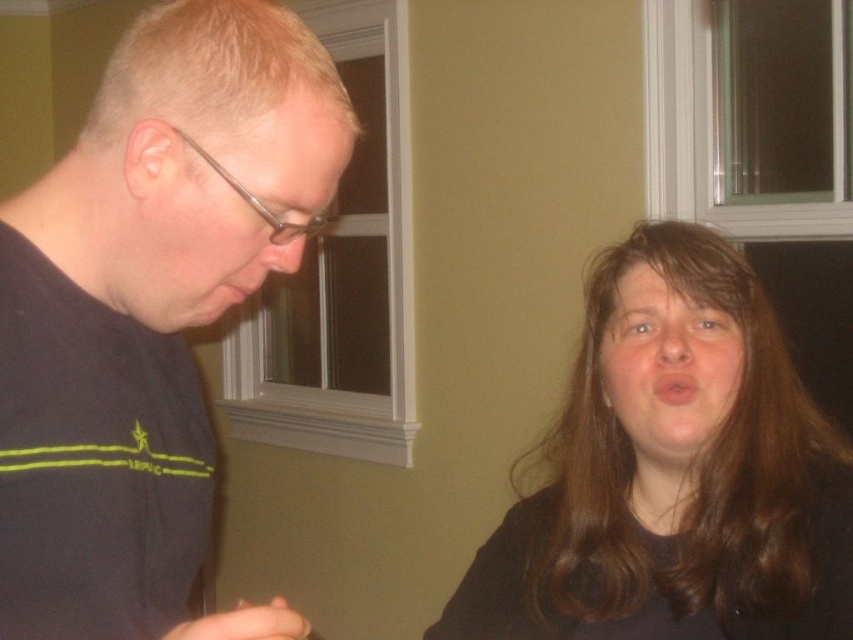
Does matte black glasses at left have a lesser height compared to matte black face at center?

Correct, matte black glasses at left is not as tall as matte black face at center.

Is matte black glasses at left to the left of matte black face at center from the viewer's perspective?

Indeed, matte black glasses at left is positioned on the left side of matte black face at center.

Is point (248, 212) less distant than point (720, 348)?

Yes, point (248, 212) is closer to viewer.

Identify the location of matte black glasses at left. The image size is (853, 640). (231, 202).

Which is in front, point (94, 116) or point (732, 324)?

Point (94, 116) is in front.

Between black matte shirt at left and matte black face at center, which one is positioned higher?

Positioned higher is black matte shirt at left.

You are a GUI agent. You are given a task and a screenshot of the screen. Output one action in this format:
    pyautogui.click(x=<x>, y=<y>)
    Task: Click on the black matte shirt at left
    
    Given the screenshot: What is the action you would take?
    tap(192, 163)

Based on the photo, can you confirm if black matte shirt at left is smaller than matte black glasses at left?

Incorrect, black matte shirt at left is not smaller in size than matte black glasses at left.

Is black matte shirt at left to the left of matte black glasses at left from the viewer's perspective?

Correct, you'll find black matte shirt at left to the left of matte black glasses at left.

Who is more forward, (285, 611) or (299, 227)?

Point (285, 611) is more forward.

This screenshot has height=640, width=853. Identify the location of black matte shirt at left. (192, 163).